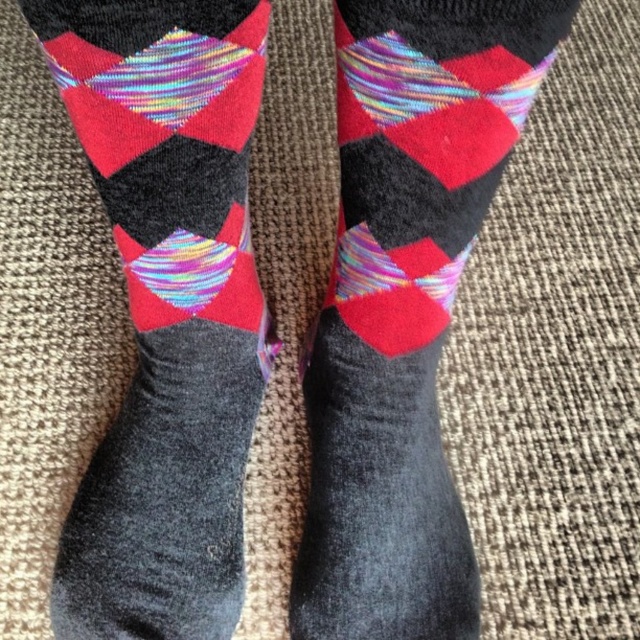
Question: Which point is farther to the camera?

Choices:
 (A) textured wool socks at center
 (B) holographic fabric socks at center

Answer: (A)

Question: Observing the image, what is the correct spatial positioning of textured wool socks at center in reference to holographic fabric socks at center?

Choices:
 (A) left
 (B) right

Answer: (A)

Question: Can you confirm if textured wool socks at center is thinner than holographic fabric socks at center?

Choices:
 (A) no
 (B) yes

Answer: (A)

Question: Which point appears closest to the camera in this image?

Choices:
 (A) (138, 40)
 (B) (442, 330)

Answer: (A)

Question: From the image, what is the correct spatial relationship of textured wool socks at center in relation to holographic fabric socks at center?

Choices:
 (A) below
 (B) above

Answer: (B)